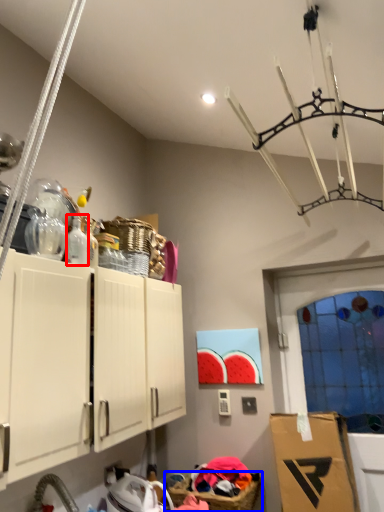
Question: Among these objects, which one is farthest to the camera, bottle (highlighted by a red box) or basket (highlighted by a blue box)?

Choices:
 (A) bottle
 (B) basket

Answer: (B)